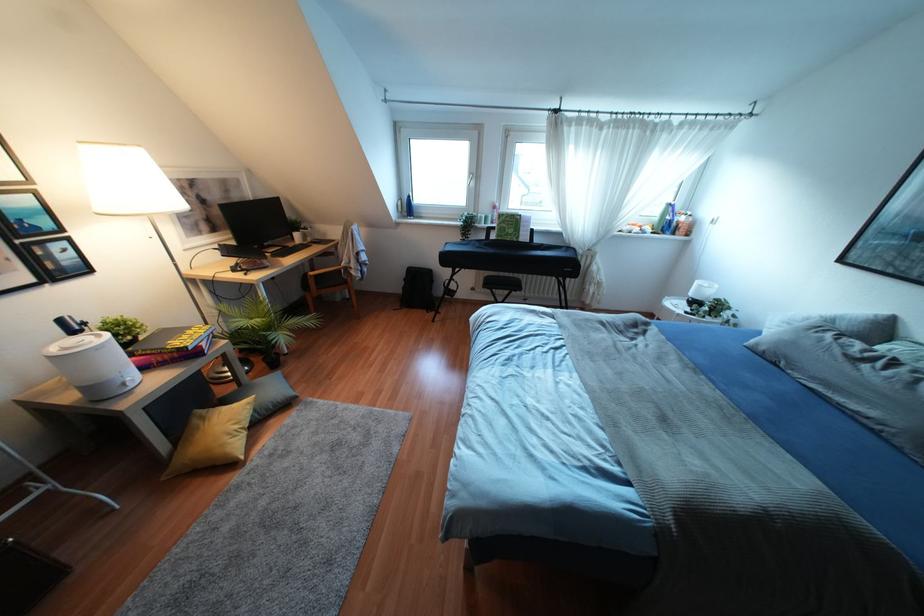
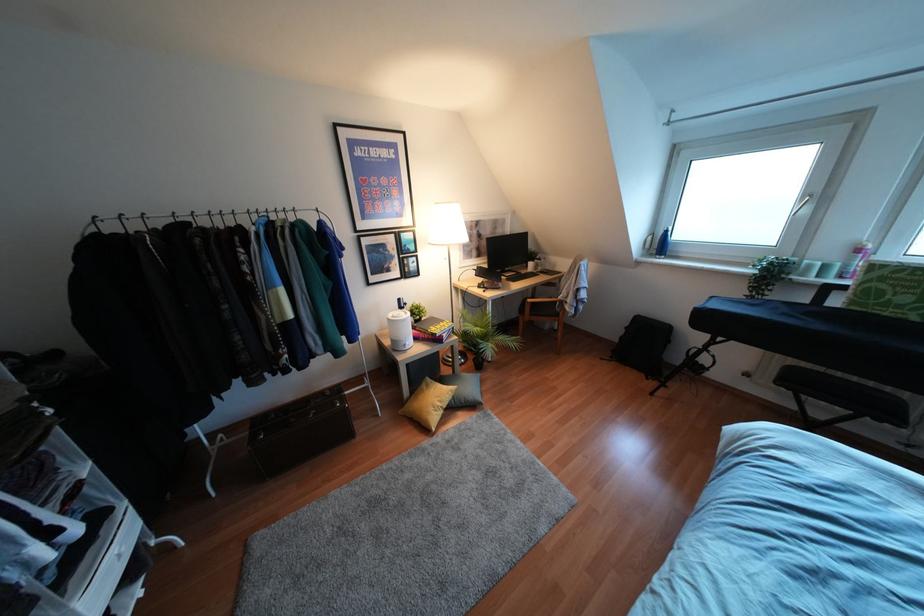
Question: The camera is either moving clockwise (left) or counter-clockwise (right) around the object. The first image is from the beginning of the video and the second image is from the end. Is the camera moving left or right when shooting the video?

Choices:
 (A) Left
 (B) Right

Answer: (B)